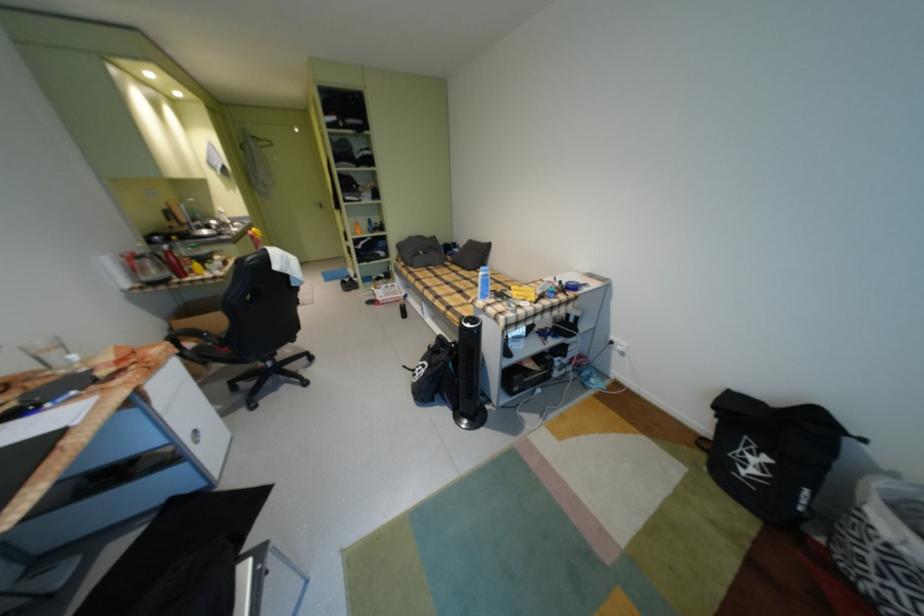
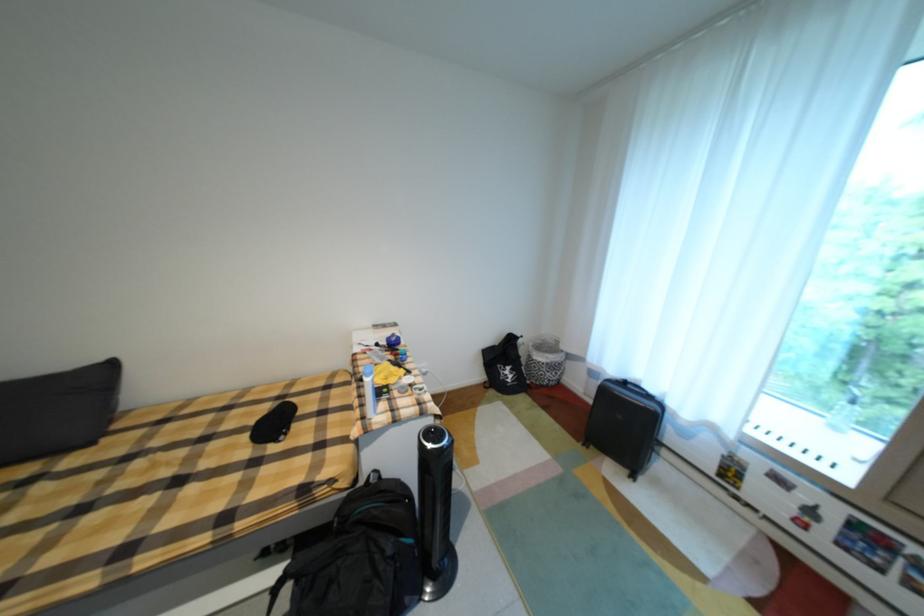
Find the pixel in the second image that matches (874,442) in the first image.

(531, 338)